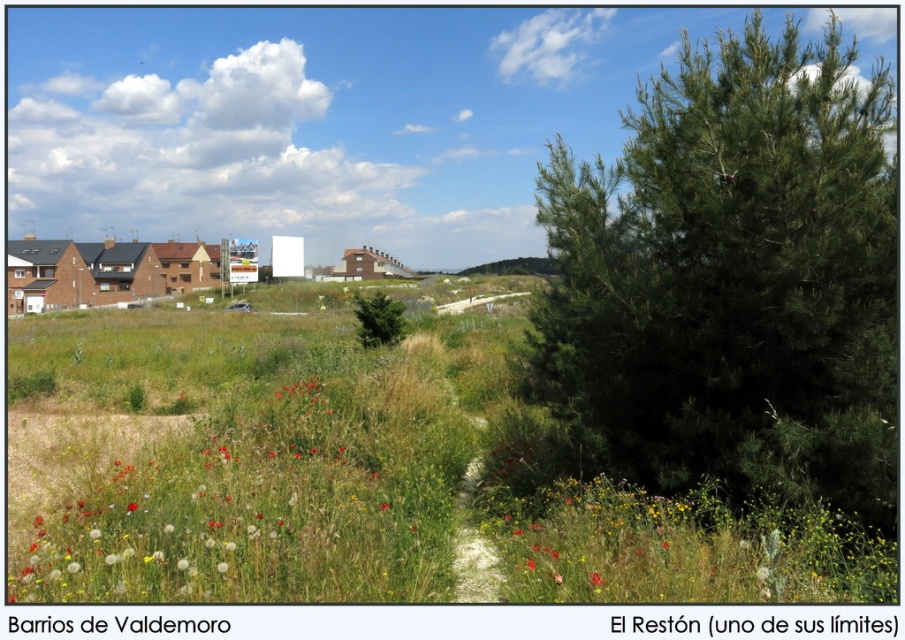
You are a hiker standing at the edge of the dirt path in the field. You notice the green matte tree at center and the red matte flower at center. Which object is taller?

The green matte tree at center is taller than the red matte flower at center.

You are a hiker standing at the starting point of the dirt path in the image. You want to walk to the red matte flower at center. However, there is a green matte tree at center blocking your path. Can you walk around the tree to reach the flower without going off the path?

The green matte tree at center and red matte flower at center are 24.69 meters apart. Since the tree is blocking the path, you can walk around it to reach the flower as long as there is enough space along the path. However, the exact distance between them suggests that the path might be wide enough to navigate around the tree without leaving the path.